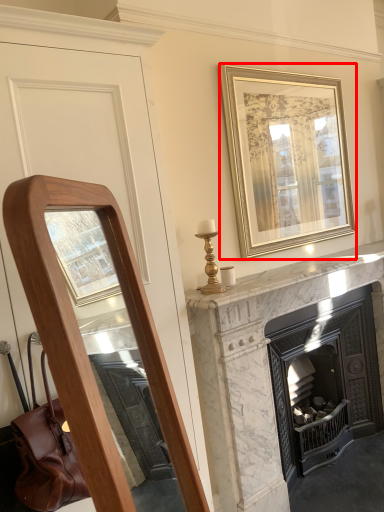
Question: From the image's perspective, where is picture frame (annotated by the red box) located relative to fireplace?

Choices:
 (A) above
 (B) below

Answer: (A)